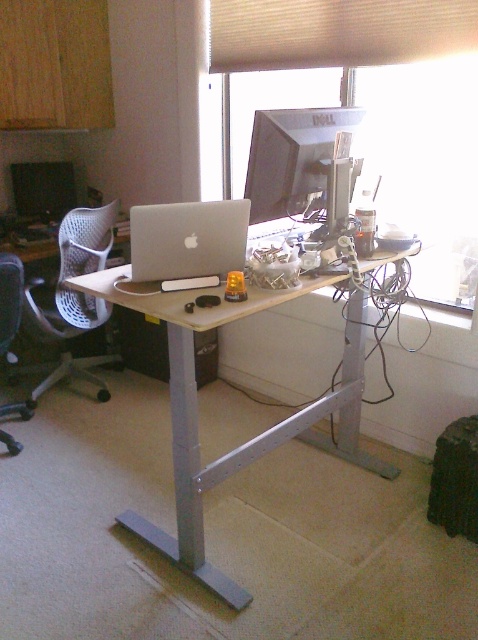
Who is taller, matte black monitor at upper center or black fabric office chair at left?

matte black monitor at upper center

Is point (316, 108) farther from viewer compared to point (22, 404)?

That is False.

What do you see at coordinates (293, 157) in the screenshot?
I see `matte black monitor at upper center` at bounding box center [293, 157].

This screenshot has height=640, width=478. What are the coordinates of `matte black monitor at upper center` in the screenshot? It's located at (293, 157).

Is light brown wood desk at center wider than matte black monitor at upper center?

Correct, the width of light brown wood desk at center exceeds that of matte black monitor at upper center.

Which is in front, point (362, 368) or point (297, 161)?

Point (297, 161) is more forward.

At what (x,y) coordinates should I click in order to perform the action: click on light brown wood desk at center. Please return your answer as a coordinate pair (x, y). Image resolution: width=478 pixels, height=640 pixels. Looking at the image, I should click on (196, 400).

Looking at this image, which of these two, light brown wood desk at center or silver metallic laptop at center, stands shorter?

With less height is silver metallic laptop at center.

Consider the image. Who is more distant from viewer, (115, 301) or (176, 211)?

Positioned behind is point (176, 211).

Which is behind, point (184, 422) or point (197, 273)?

The point (197, 273) is behind.

Find the location of a particular element. The image size is (478, 640). light brown wood desk at center is located at coordinates (196, 400).